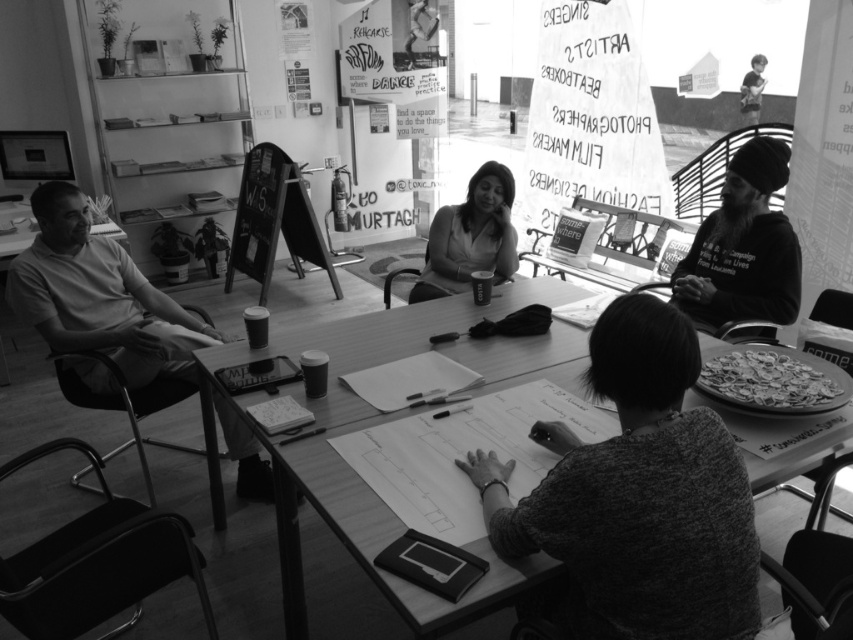
Question: Which object is farther from the camera taking this photo?

Choices:
 (A) crusty pizza at lower right
 (B) smooth white shirt at left
 (C) black chalkboard sign at center-left
 (D) smooth black shirt at center

Answer: (C)

Question: Considering the relative positions of crusty pizza at lower right and black chalkboard sign at center-left in the image provided, where is crusty pizza at lower right located with respect to black chalkboard sign at center-left?

Choices:
 (A) left
 (B) right

Answer: (B)

Question: Which object is farther from the camera taking this photo?

Choices:
 (A) black chalkboard sign at center-left
 (B) crusty pizza at lower right
 (C) smooth white shirt at left
 (D) smooth black shirt at center

Answer: (A)

Question: Can you confirm if smooth white shirt at left is positioned to the right of smooth black shirt at center?

Choices:
 (A) yes
 (B) no

Answer: (B)

Question: Can you confirm if wooden table at center is positioned to the right of smooth white shirt at left?

Choices:
 (A) no
 (B) yes

Answer: (B)

Question: Which of the following is the farthest from the observer?

Choices:
 (A) smooth black shirt at center
 (B) black chalkboard sign at center-left
 (C) crusty pizza at lower right

Answer: (B)